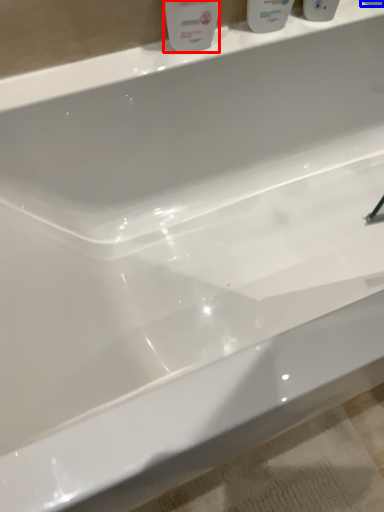
Question: Which of the following is the farthest to the observer, cleaning product (highlighted by a red box) or mouthwash (highlighted by a blue box)?

Choices:
 (A) cleaning product
 (B) mouthwash

Answer: (B)